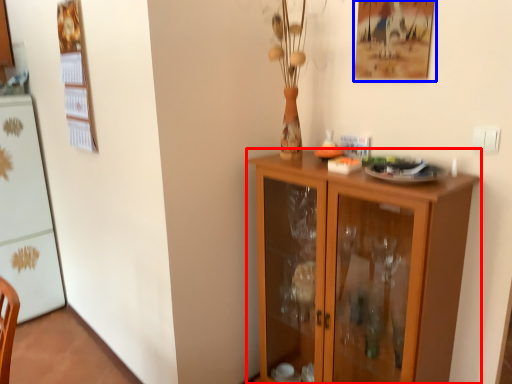
Question: Among these objects, which one is farthest to the camera, cupboard (highlighted by a red box) or picture frame (highlighted by a blue box)?

Choices:
 (A) cupboard
 (B) picture frame

Answer: (B)